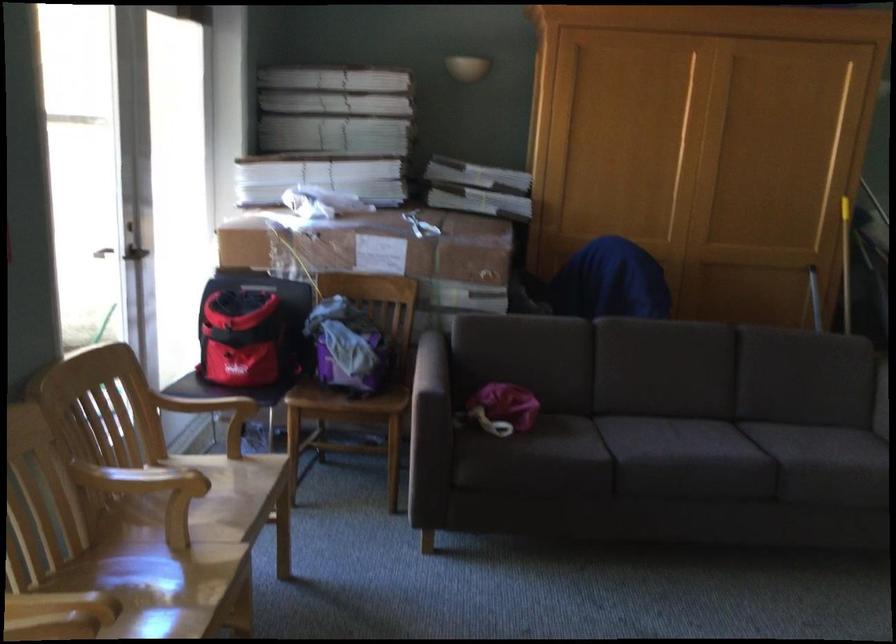
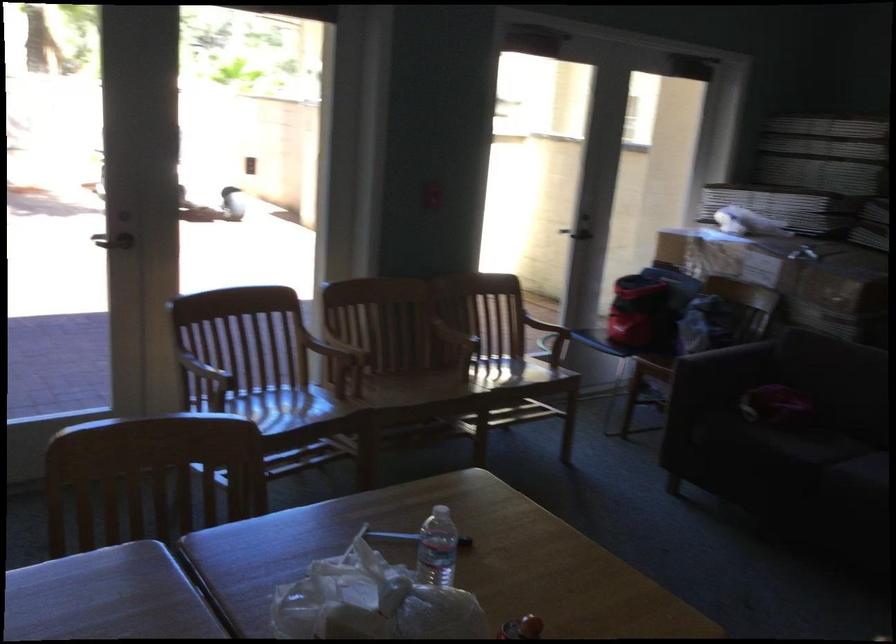
Question: I am providing you with two images of the same scene from different viewpoints. Which of the following objects are not visible in image2?

Choices:
 (A) lever door handle
 (B) white plastic colander
 (C) plastic water bottle
 (D) wooden chair armrest

Answer: (D)